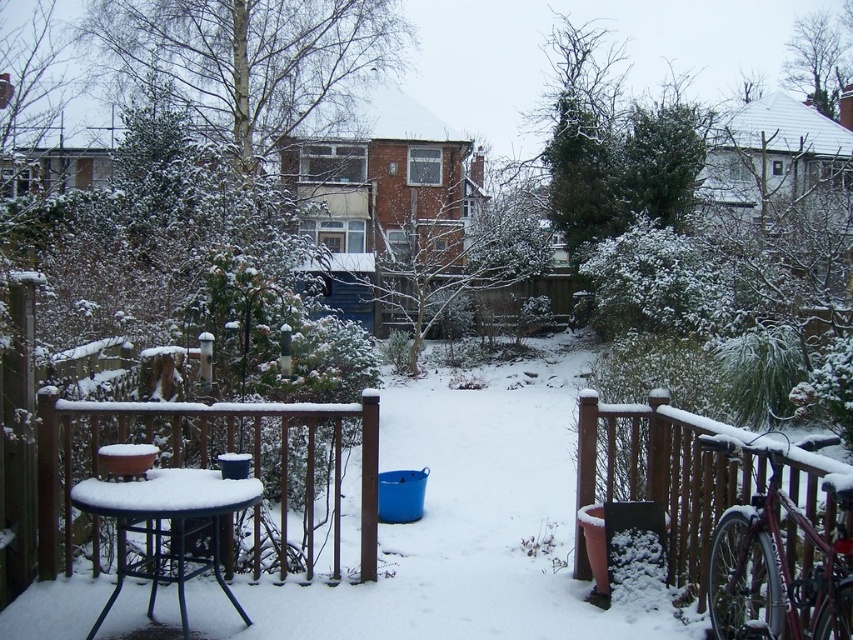
You are standing in the winter backyard scene. You see a blue bucket near the center of the yard and a point marked at coordinates (212, 460). What object is the point on?

The point at coordinates (212, 460) is on the brown wooden fence at center.

From the picture: You are planning to place a new bench in the backyard. You have two options for locations based on the existing brown wooden fence at lower right and the brown wooden fence at center. Which fence would allow the bench to be placed closer to the center of the yard without blocking the view of the snow covered small round table?

The brown wooden fence at lower right has a smaller size compared to the brown wooden fence at center, so placing the bench near the brown wooden fence at lower right would allow it to be closer to the center of the yard without blocking the view of the snow covered small round table.

You are standing in the snowy backyard and want to move from the wooden railing towards the blue bucket. Which point, point (611, 433) or point (306, 532), is closer to you as you walk towards the blue bucket?

Point (611, 433) is closer to you because it is further to the viewer than point (306, 532), meaning it is nearer to your current position.